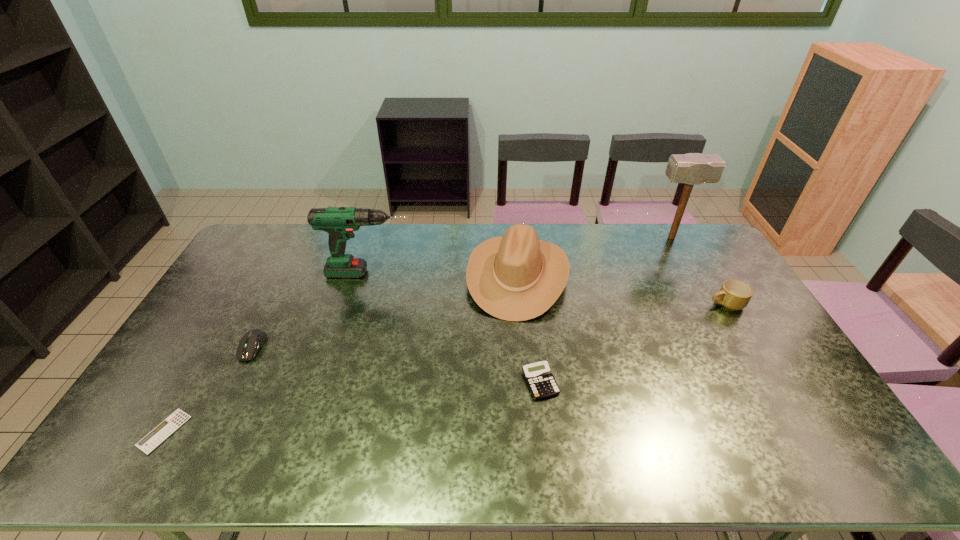
Find the location of a particular element. the leftmost object is located at coordinates tap(167, 427).

You are a GUI agent. You are given a task and a screenshot of the screen. Output one action in this format:
    pyautogui.click(x=<x>, y=<y>)
    Task: Click on the free space located 0.250m on the striking face of the mallet
    
    Given the screenshot: What is the action you would take?
    pyautogui.click(x=587, y=238)

Locate an element on the screen. vacant space situated 0.130m on the striking face of the mallet is located at coordinates (616, 238).

The width and height of the screenshot is (960, 540). Find the location of `free space located on the striking face of the mallet`. free space located on the striking face of the mallet is located at coordinates (627, 238).

Find the location of a particular element. This screenshot has height=540, width=960. free space located on the handle side of the third object from left to right is located at coordinates (506, 273).

In order to click on free point located on the front of the third tallest object in this screenshot , I will do pos(533,435).

The image size is (960, 540). I want to click on vacant region located 0.120m on the side with the handle of the fourth tallest object, so click(x=671, y=303).

In order to click on free spot located on the side with the handle of the fourth tallest object in this screenshot , I will do `click(632, 303)`.

The image size is (960, 540). I want to click on vacant space located 0.060m on the side with the handle of the fourth tallest object, so click(689, 303).

Locate an element on the screen. The image size is (960, 540). blank space located 0.070m on the button of the fifth farthest object is located at coordinates (235, 382).